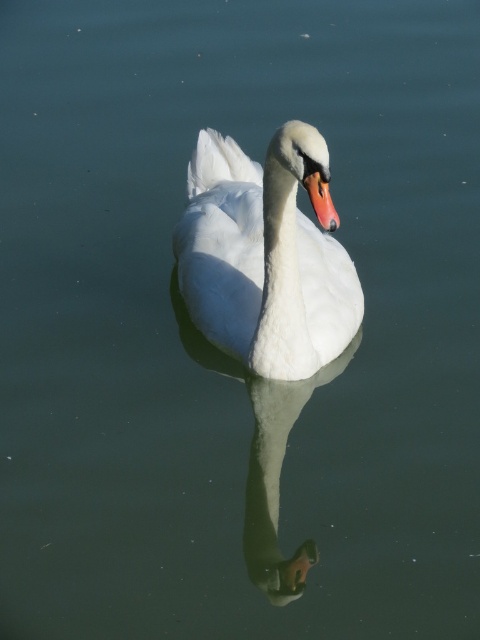
Question: Which of the following is the closest to the observer?

Choices:
 (A) (272, 508)
 (B) (256, 244)
 (C) (315, 208)

Answer: (C)

Question: Does white glossy swan at center appear on the right side of white glossy swan neck at center?

Choices:
 (A) no
 (B) yes

Answer: (A)

Question: Which point is closer to the camera?

Choices:
 (A) (178, 236)
 (B) (303, 580)

Answer: (B)

Question: Which point is farther from the camera taking this photo?

Choices:
 (A) [328, 221]
 (B) [268, 486]
 (C) [222, 282]

Answer: (C)

Question: Can you confirm if white glossy swan at center is positioned to the right of white glossy swan neck at center?

Choices:
 (A) yes
 (B) no

Answer: (B)

Question: Can you confirm if white glossy swan neck at center is thinner than matte orange beak at center?

Choices:
 (A) yes
 (B) no

Answer: (B)